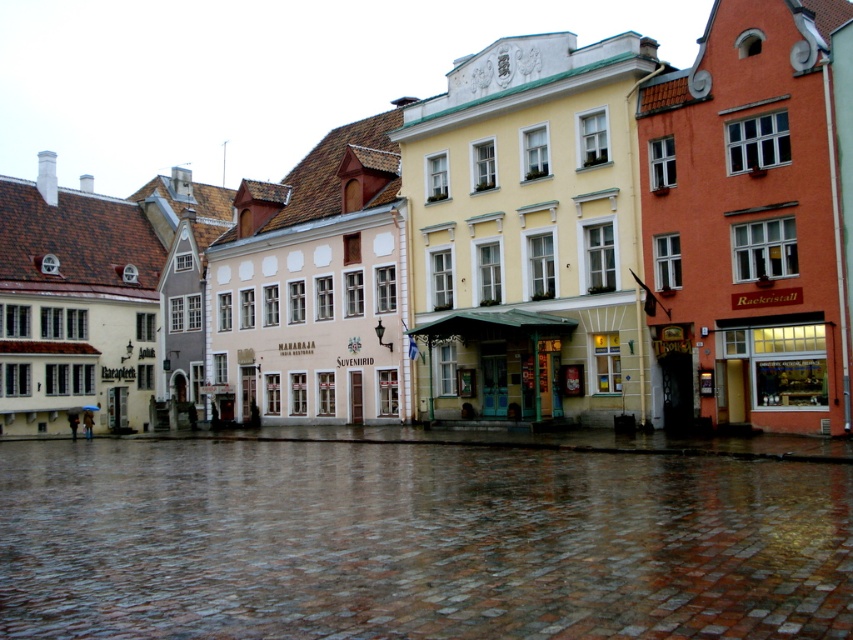
Question: Which of the following is the farthest from the observer?

Choices:
 (A) matte glass storefront at right
 (B) green glass kiosk at center

Answer: (B)

Question: Does brown stone pavement at lower center appear under green glass kiosk at center?

Choices:
 (A) yes
 (B) no

Answer: (A)

Question: Which of the following is the farthest from the observer?

Choices:
 (A) green glass kiosk at center
 (B) matte glass storefront at right

Answer: (A)

Question: Which object is the farthest from the brown stone pavement at lower center?

Choices:
 (A) matte glass storefront at right
 (B) green glass kiosk at center

Answer: (B)

Question: Can you confirm if brown stone pavement at lower center is thinner than matte glass storefront at right?

Choices:
 (A) no
 (B) yes

Answer: (A)

Question: Can you confirm if brown stone pavement at lower center is smaller than matte glass storefront at right?

Choices:
 (A) yes
 (B) no

Answer: (B)